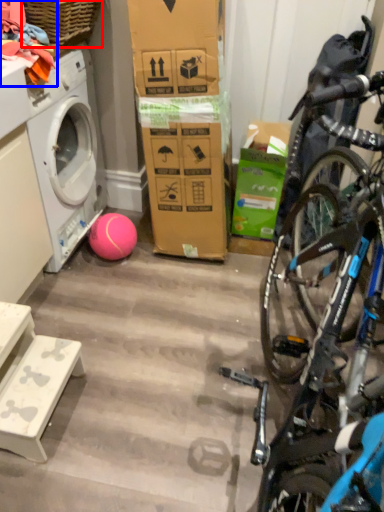
Question: Which of the following is the farthest to the observer, picnic basket (highlighted by a red box) or clothing (highlighted by a blue box)?

Choices:
 (A) picnic basket
 (B) clothing

Answer: (A)